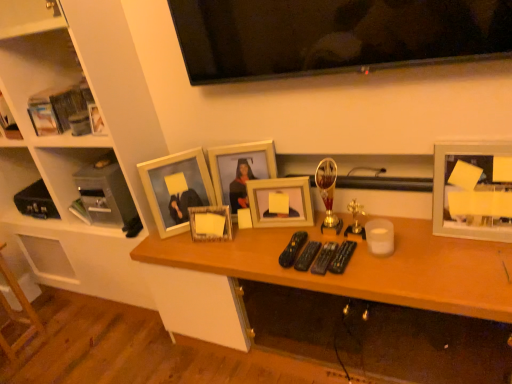
Question: From the image's perspective, is matte wooden picture frame at center, arranged as the 1th picture frame when viewed from the left, located above white wood shelf at upper left, acting as the 1th furniture starting from the top?

Choices:
 (A) yes
 (B) no

Answer: (B)

Question: Is matte wooden picture frame at center, which appears as the 5th picture frame when viewed from the right, positioned with its back to white wood shelf at upper left, acting as the 1th furniture starting from the top?

Choices:
 (A) yes
 (B) no

Answer: (A)

Question: Is white wood shelf at upper left, which is the second furniture from bottom to top, inside matte wooden picture frame at center, which appears as the 5th picture frame when viewed from the right?

Choices:
 (A) no
 (B) yes

Answer: (A)

Question: Could you tell me if matte wooden picture frame at center, arranged as the 1th picture frame when viewed from the left, is turned towards white wood shelf at upper left, acting as the 1th furniture starting from the top?

Choices:
 (A) yes
 (B) no

Answer: (B)

Question: Is matte wooden picture frame at center, which appears as the 5th picture frame when viewed from the right, to the left of white wood shelf at upper left, which is the second furniture from bottom to top, from the viewer's perspective?

Choices:
 (A) yes
 (B) no

Answer: (B)

Question: Is matte wooden picture frame at center, arranged as the 1th picture frame when viewed from the left, in front of white wood shelf at upper left, acting as the 1th furniture starting from the top?

Choices:
 (A) no
 (B) yes

Answer: (A)

Question: Can you confirm if matte wooden picture frame at center, which is the third picture frame in left-to-right order, is positioned to the left of matte wooden picture frame at center, the 4th picture frame from the left?

Choices:
 (A) no
 (B) yes

Answer: (B)

Question: Considering the relative sizes of matte wooden picture frame at center, which is the third picture frame in left-to-right order, and matte wooden picture frame at center, the 2th picture frame viewed from the right, in the image provided, is matte wooden picture frame at center, which is the third picture frame in left-to-right order, taller than matte wooden picture frame at center, the 2th picture frame viewed from the right,?

Choices:
 (A) yes
 (B) no

Answer: (A)

Question: Can you confirm if matte wooden picture frame at center, the 3th picture frame when ordered from right to left, is wider than matte wooden picture frame at center, the 2th picture frame viewed from the right?

Choices:
 (A) no
 (B) yes

Answer: (B)

Question: Is matte wooden picture frame at center, which is the third picture frame in left-to-right order, aimed at matte wooden picture frame at center, the 4th picture frame from the left?

Choices:
 (A) yes
 (B) no

Answer: (A)

Question: Is matte wooden picture frame at center, which is the third picture frame in left-to-right order, positioned in front of matte wooden picture frame at center, the 4th picture frame from the left?

Choices:
 (A) yes
 (B) no

Answer: (B)

Question: From a real-world perspective, is matte wooden picture frame at center, the 3th picture frame when ordered from right to left, under matte wooden picture frame at center, the 4th picture frame from the left?

Choices:
 (A) yes
 (B) no

Answer: (B)

Question: Does flat screen tv at upper center have a greater width compared to matte wooden picture frame at center, arranged as the 1th picture frame when viewed from the left?

Choices:
 (A) yes
 (B) no

Answer: (B)